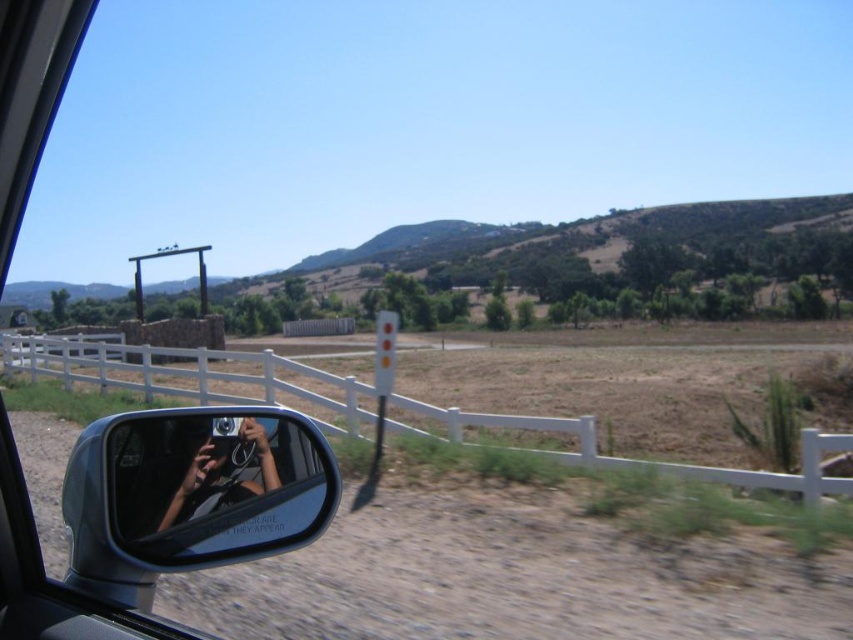
Question: In this image, where is clear glass mirror at lower left located relative to matte black camera at lower center?

Choices:
 (A) left
 (B) right

Answer: (B)

Question: In this image, where is clear glass mirror at lower left located relative to matte black camera at lower center?

Choices:
 (A) left
 (B) right

Answer: (B)

Question: Does clear glass mirror at lower left lie behind matte black camera at lower center?

Choices:
 (A) yes
 (B) no

Answer: (A)

Question: Which of the following is the farthest from the observer?

Choices:
 (A) (274, 433)
 (B) (270, 490)

Answer: (A)

Question: Which is nearer to the white wooden fence at lower right?

Choices:
 (A) clear glass mirror at lower left
 (B) matte black camera at lower center

Answer: (B)

Question: Considering the real-world distances, which object is farthest from the matte black camera at lower center?

Choices:
 (A) white wooden fence at lower right
 (B) clear glass mirror at lower left

Answer: (A)